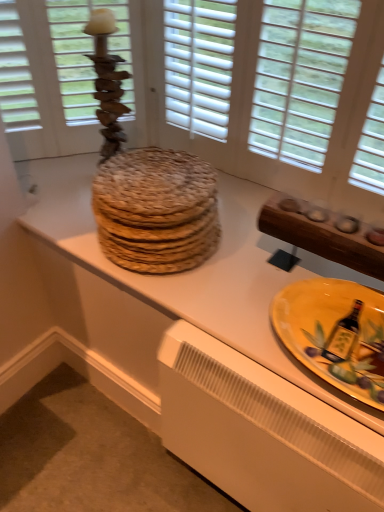
Question: Is wooden candlestick at upper left shorter than wooden textured platters at center?

Choices:
 (A) yes
 (B) no

Answer: (B)

Question: From a real-world perspective, is wooden candlestick at upper left under wooden textured platters at center?

Choices:
 (A) yes
 (B) no

Answer: (B)

Question: Is wooden candlestick at upper left at the left side of wooden textured platters at center?

Choices:
 (A) yes
 (B) no

Answer: (A)

Question: Is wooden candlestick at upper left touching wooden textured platters at center?

Choices:
 (A) yes
 (B) no

Answer: (B)

Question: Is wooden textured platters at center at the back of wooden candlestick at upper left?

Choices:
 (A) yes
 (B) no

Answer: (B)

Question: In terms of width, does wooden candlestick at upper left look wider or thinner when compared to yellow glazed plate at lower right?

Choices:
 (A) wide
 (B) thin

Answer: (B)

Question: Do you think wooden candlestick at upper left is within yellow glazed plate at lower right, or outside of it?

Choices:
 (A) inside
 (B) outside

Answer: (B)

Question: From the image's perspective, is wooden candlestick at upper left located above or below yellow glazed plate at lower right?

Choices:
 (A) above
 (B) below

Answer: (A)

Question: In terms of height, does wooden candlestick at upper left look taller or shorter compared to yellow glazed plate at lower right?

Choices:
 (A) short
 (B) tall

Answer: (B)

Question: Is white plastic radiator at lower center wider or thinner than yellow glazed plate at lower right?

Choices:
 (A) thin
 (B) wide

Answer: (A)

Question: Choose the correct answer: Is white plastic radiator at lower center inside yellow glazed plate at lower right or outside it?

Choices:
 (A) outside
 (B) inside

Answer: (A)

Question: From a real-world perspective, is white plastic radiator at lower center positioned above or below yellow glazed plate at lower right?

Choices:
 (A) below
 (B) above

Answer: (A)

Question: Considering the relative positions of white plastic radiator at lower center and yellow glazed plate at lower right in the image provided, is white plastic radiator at lower center to the left or to the right of yellow glazed plate at lower right?

Choices:
 (A) left
 (B) right

Answer: (A)

Question: From a real-world perspective, is wooden candlestick at upper left positioned above or below wooden textured platters at center?

Choices:
 (A) below
 (B) above

Answer: (B)

Question: Considering the positions of wooden candlestick at upper left and wooden textured platters at center in the image, is wooden candlestick at upper left taller or shorter than wooden textured platters at center?

Choices:
 (A) short
 (B) tall

Answer: (B)